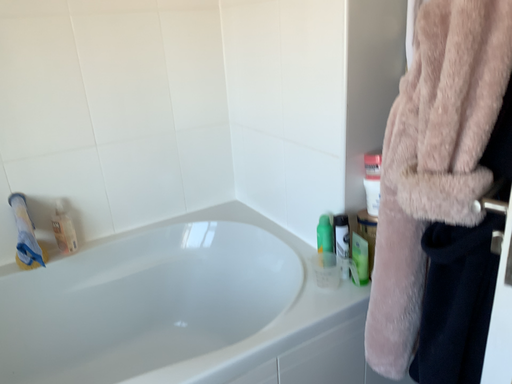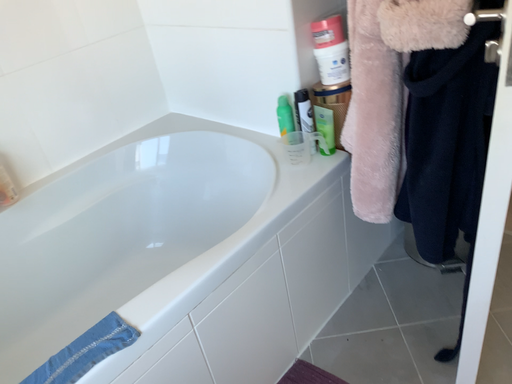
Question: How did the camera likely rotate when shooting the video?

Choices:
 (A) rotated downward
 (B) rotated upward

Answer: (A)